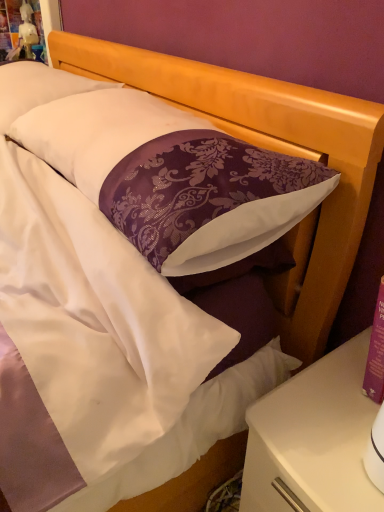
Question: Can you confirm if purple damask pillow at center, arranged as the 2th pillow when viewed from the back, is shorter than white glossy nightstand at lower right?

Choices:
 (A) no
 (B) yes

Answer: (B)

Question: Can you confirm if purple damask pillow at center, the first pillow positioned from the front, is thinner than white glossy nightstand at lower right?

Choices:
 (A) yes
 (B) no

Answer: (A)

Question: Can you confirm if purple damask pillow at center, arranged as the 2th pillow when viewed from the back, is bigger than white glossy nightstand at lower right?

Choices:
 (A) no
 (B) yes

Answer: (B)

Question: Is purple damask pillow at center, arranged as the 2th pillow when viewed from the back, positioned with its back to white glossy nightstand at lower right?

Choices:
 (A) yes
 (B) no

Answer: (B)

Question: Does purple damask pillow at center, arranged as the 2th pillow when viewed from the back, have a greater height compared to white glossy nightstand at lower right?

Choices:
 (A) yes
 (B) no

Answer: (B)

Question: From the image's perspective, relative to white satin pillow at upper left, which appears as the second pillow when viewed from the front, is purple damask pillow at center, arranged as the 2th pillow when viewed from the back, above or below?

Choices:
 (A) below
 (B) above

Answer: (A)

Question: In terms of width, does purple damask pillow at center, arranged as the 2th pillow when viewed from the back, look wider or thinner when compared to white satin pillow at upper left, which appears as the second pillow when viewed from the front?

Choices:
 (A) thin
 (B) wide

Answer: (B)

Question: Considering the positions of purple damask pillow at center, arranged as the 2th pillow when viewed from the back, and white satin pillow at upper left, positioned as the first pillow in back-to-front order, in the image, is purple damask pillow at center, arranged as the 2th pillow when viewed from the back, bigger or smaller than white satin pillow at upper left, positioned as the first pillow in back-to-front order,?

Choices:
 (A) small
 (B) big

Answer: (B)

Question: Is purple damask pillow at center, arranged as the 2th pillow when viewed from the back, in front of or behind white satin pillow at upper left, positioned as the first pillow in back-to-front order, in the image?

Choices:
 (A) behind
 (B) front

Answer: (B)

Question: From the image's perspective, is white satin pillow at upper left, positioned as the first pillow in back-to-front order, positioned above or below white glossy nightstand at lower right?

Choices:
 (A) above
 (B) below

Answer: (A)

Question: From a real-world perspective, is white satin pillow at upper left, positioned as the first pillow in back-to-front order, physically located above or below white glossy nightstand at lower right?

Choices:
 (A) above
 (B) below

Answer: (A)

Question: Would you say white satin pillow at upper left, positioned as the first pillow in back-to-front order, is inside or outside white glossy nightstand at lower right?

Choices:
 (A) outside
 (B) inside

Answer: (A)

Question: Is white satin pillow at upper left, positioned as the first pillow in back-to-front order, wider or thinner than white glossy nightstand at lower right?

Choices:
 (A) thin
 (B) wide

Answer: (A)

Question: In terms of size, does purple damask pillow at center, arranged as the 2th pillow when viewed from the back, appear bigger or smaller than white glossy nightstand at lower right?

Choices:
 (A) big
 (B) small

Answer: (A)

Question: Would you say purple damask pillow at center, the first pillow positioned from the front, is to the left or to the right of white glossy nightstand at lower right in the picture?

Choices:
 (A) left
 (B) right

Answer: (A)